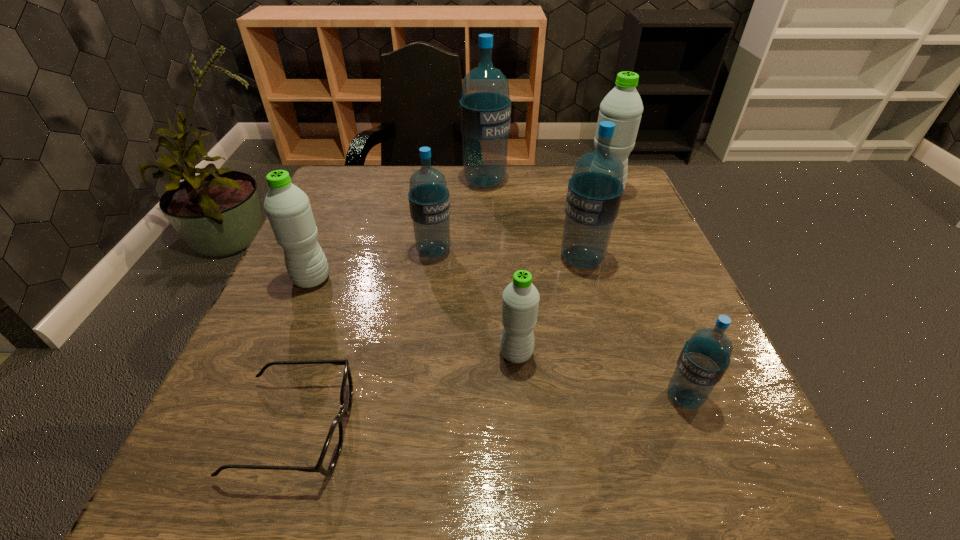
In the image, there is a desktop. Where is `free space at the left edge`? The height and width of the screenshot is (540, 960). free space at the left edge is located at coordinates (328, 294).

This screenshot has width=960, height=540. I want to click on free point at the right edge, so click(x=661, y=308).

The image size is (960, 540). In the image, there is a desktop. Find the location of `vacant space at the far left corner`. vacant space at the far left corner is located at coordinates (334, 175).

Where is `vacant region at the near left corner of the desktop`? The height and width of the screenshot is (540, 960). vacant region at the near left corner of the desktop is located at coordinates (258, 494).

What are the coordinates of `free space at the far right corner of the desktop` in the screenshot? It's located at (621, 207).

Locate an element on the screen. The image size is (960, 540). empty space that is in between the rightmost blue water bottle and the sixth water bottle from right to left is located at coordinates (559, 324).

Image resolution: width=960 pixels, height=540 pixels. In order to click on free space between the leftmost green water bottle and the rightmost blue water bottle in this screenshot , I will do `click(498, 338)`.

Image resolution: width=960 pixels, height=540 pixels. What are the coordinates of `vacant area that lies between the leftmost green water bottle and the farthest blue water bottle` in the screenshot? It's located at (398, 231).

In order to click on free space between the third object from left to right and the farthest green water bottle in this screenshot , I will do `click(518, 222)`.

Identify the location of vacant point located between the nearest blue water bottle and the shortest object. This screenshot has width=960, height=540. (490, 413).